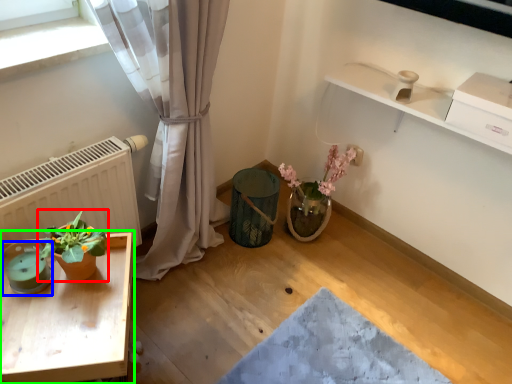
Question: Based on their relative distances, which object is farther from houseplant (highlighted by a red box)? Choose from teal (highlighted by a blue box) and table (highlighted by a green box).

Choices:
 (A) teal
 (B) table

Answer: (B)